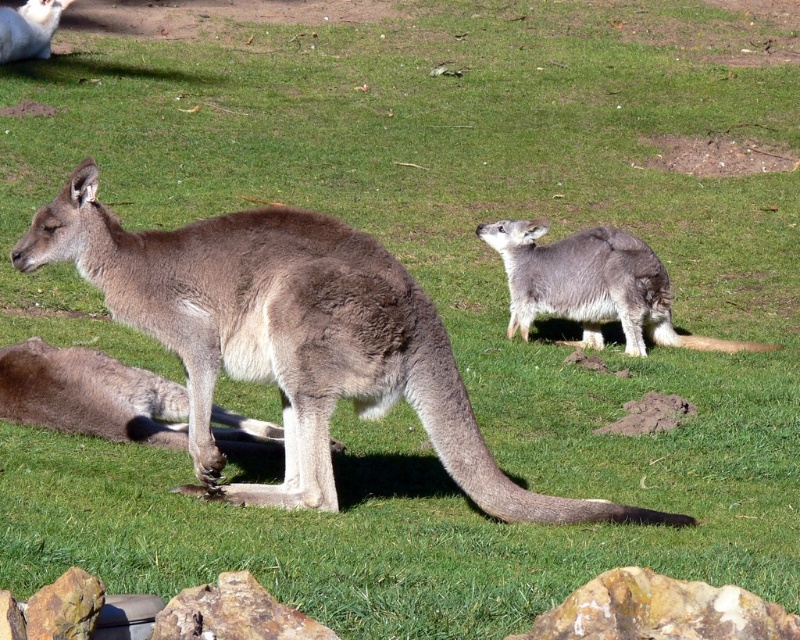
Question: Among these objects, which one is farthest from the camera?

Choices:
 (A) rusty rock at lower center
 (B) brown fur kangaroo at upper left

Answer: (B)

Question: Among these objects, which one is farthest from the camera?

Choices:
 (A) gray furry kangaroo at center
 (B) gray fur kangaroo at center

Answer: (A)

Question: Does gray fur kangaroo at center appear on the right side of gray furry kangaroo at center?

Choices:
 (A) yes
 (B) no

Answer: (B)

Question: Where is gray furry kangaroo at center located in relation to brown rough rock at lower center in the image?

Choices:
 (A) below
 (B) above

Answer: (B)

Question: Estimate the real-world distances between objects in this image. Which object is farther from the gray fur kangaroo at center?

Choices:
 (A) gray furry kangaroo at center
 (B) brown fur kangaroo at upper left
 (C) brown rough rock at lower center

Answer: (B)

Question: Is gray fur kangaroo at center below gray furry kangaroo at center?

Choices:
 (A) no
 (B) yes

Answer: (B)